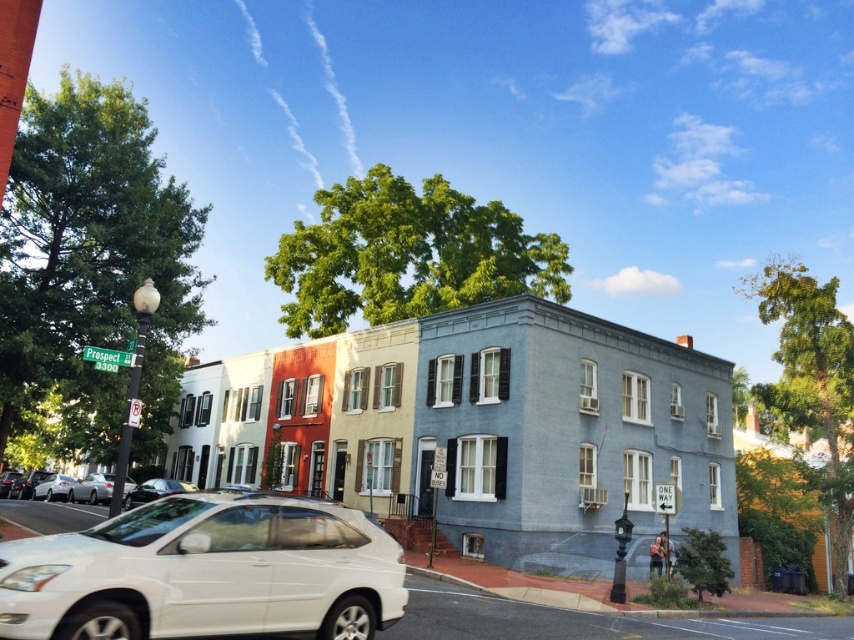
Question: Does metallic silver sedan at center appear over silver metallic sedan at lower left?

Choices:
 (A) yes
 (B) no

Answer: (A)

Question: Does white matte car at lower left have a smaller size compared to metallic silver sedan at center?

Choices:
 (A) yes
 (B) no

Answer: (B)

Question: Which object is closer to the camera taking this photo?

Choices:
 (A) silver metallic sedan at lower left
 (B) silver metallic sedan at center

Answer: (B)

Question: Which is farther from the matte white sedan at center?

Choices:
 (A) white matte car at lower left
 (B) silver metallic sedan at center
 (C) metallic silver sedan at center
 (D) silver metallic sedan at lower left

Answer: (D)

Question: Which object is the farthest from the white matte car at lower left?

Choices:
 (A) silver metallic sedan at lower left
 (B) silver metallic sedan at center
 (C) metallic silver sedan at center

Answer: (A)

Question: In this image, where is silver metallic sedan at center located relative to metallic silver sedan at center?

Choices:
 (A) right
 (B) left

Answer: (A)